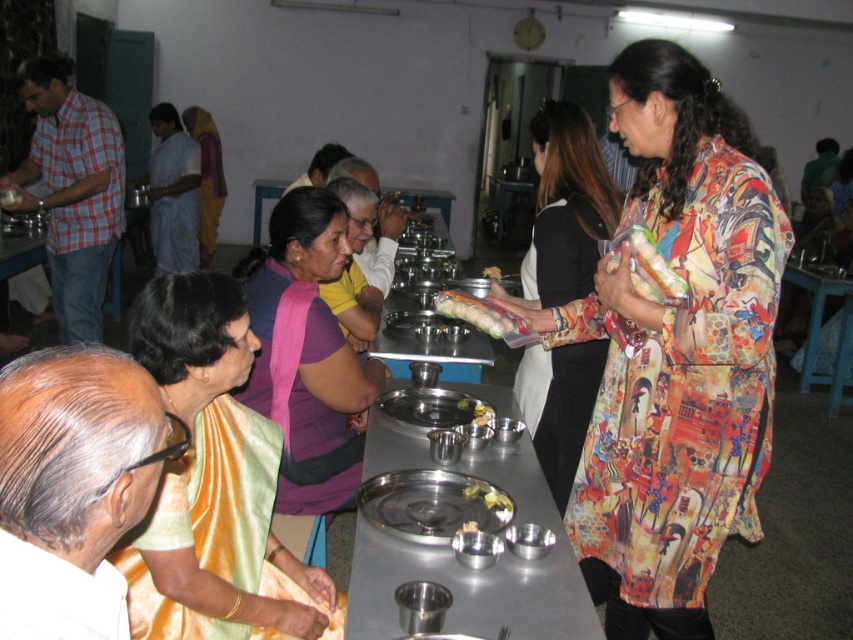
Question: Observing the image, what is the correct spatial positioning of green leafy vegetable at center in reference to white matte rice at center?

Choices:
 (A) right
 (B) left

Answer: (B)

Question: Can you confirm if white textured bread at center is smaller than green leafy vegetable at center?

Choices:
 (A) yes
 (B) no

Answer: (B)

Question: Which of the following is the farthest from the observer?

Choices:
 (A) (207, 230)
 (B) (444, 305)

Answer: (A)

Question: Among these points, which one is nearest to the camera?

Choices:
 (A) (154, 536)
 (B) (39, 208)

Answer: (A)

Question: Which point is closer to the camera?

Choices:
 (A) (492, 278)
 (B) (338, 406)
 (C) (527, 512)
 (D) (494, 314)

Answer: (C)

Question: Is translucent plastic bag at center thinner than green leafy vegetable at center?

Choices:
 (A) yes
 (B) no

Answer: (B)